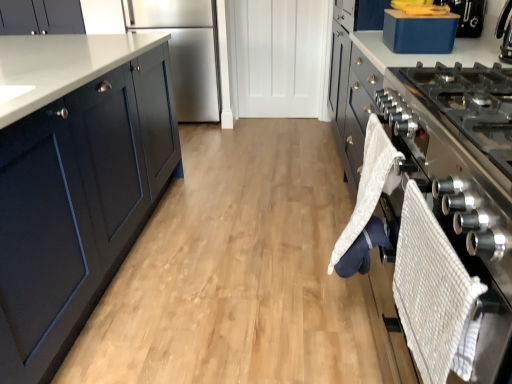
Question: Is stainless steel refrigerator at center behind matte dark blue cabinet at upper left?

Choices:
 (A) no
 (B) yes

Answer: (A)

Question: Is stainless steel refrigerator at center shorter than matte dark blue cabinet at upper left?

Choices:
 (A) no
 (B) yes

Answer: (A)

Question: From a real-world perspective, does stainless steel refrigerator at center sit lower than matte dark blue cabinet at upper left?

Choices:
 (A) yes
 (B) no

Answer: (A)

Question: Are stainless steel refrigerator at center and matte dark blue cabinet at upper left making contact?

Choices:
 (A) yes
 (B) no

Answer: (B)

Question: From the image's perspective, does stainless steel refrigerator at center appear lower than matte dark blue cabinet at upper left?

Choices:
 (A) yes
 (B) no

Answer: (A)

Question: Does stainless steel refrigerator at center have a greater height compared to matte dark blue cabinet at upper left?

Choices:
 (A) yes
 (B) no

Answer: (A)

Question: Considering the relative sizes of blue plastic container at upper right and satin silver oven at right in the image provided, is blue plastic container at upper right taller than satin silver oven at right?

Choices:
 (A) no
 (B) yes

Answer: (A)

Question: From a real-world perspective, is blue plastic container at upper right located higher than satin silver oven at right?

Choices:
 (A) no
 (B) yes

Answer: (B)

Question: Does blue plastic container at upper right appear on the left side of satin silver oven at right?

Choices:
 (A) no
 (B) yes

Answer: (A)

Question: From the image's perspective, is blue plastic container at upper right located above satin silver oven at right?

Choices:
 (A) no
 (B) yes

Answer: (B)

Question: Is blue plastic container at upper right not within satin silver oven at right?

Choices:
 (A) no
 (B) yes

Answer: (B)

Question: Is blue plastic container at upper right placed right next to satin silver oven at right?

Choices:
 (A) no
 (B) yes

Answer: (A)

Question: From the image's perspective, is satin silver oven at right below blue plastic container at upper right?

Choices:
 (A) no
 (B) yes

Answer: (B)